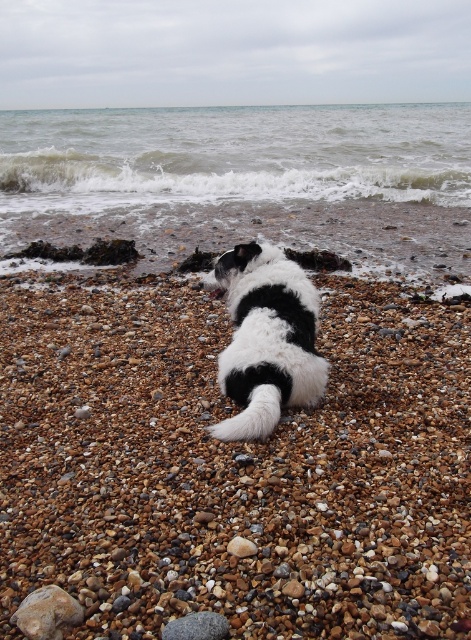
Based on the photo, is smooth pebble at center above grayish-blue water at upper center?

No.

Which of these two, smooth pebble at center or grayish-blue water at upper center, stands shorter?

smooth pebble at center

Is point (224, 317) behind point (26, 147)?

No, (224, 317) is closer to viewer.

This screenshot has width=471, height=640. What are the coordinates of `smooth pebble at center` in the screenshot? It's located at (234, 467).

Which is below, grayish-blue water at upper center or black and white fur dog at center?

Positioned lower is black and white fur dog at center.

Can you confirm if grayish-blue water at upper center is positioned to the right of black and white fur dog at center?

In fact, grayish-blue water at upper center is to the left of black and white fur dog at center.

Does point (357, 120) come behind point (294, 326)?

Yes, point (357, 120) is behind point (294, 326).

Locate an element on the screen. The width and height of the screenshot is (471, 640). grayish-blue water at upper center is located at coordinates (232, 156).

Who is positioned more to the right, smooth pebble at center or black and white fur dog at center?

Positioned to the right is smooth pebble at center.

Consider the image. Is smooth pebble at center below black and white fur dog at center?

Indeed, smooth pebble at center is positioned under black and white fur dog at center.

Measure the distance between point (349,317) and camera.

The distance of point (349,317) from camera is 14.27 feet.

Locate an element on the screen. smooth pebble at center is located at coordinates (234, 467).